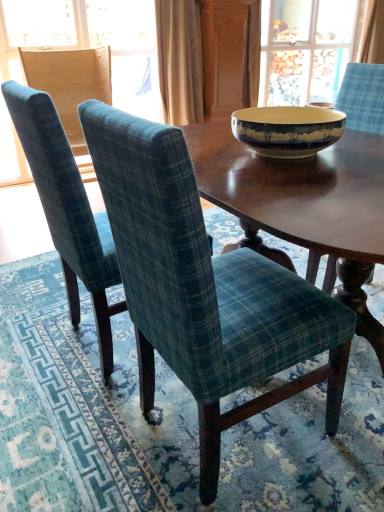
I want to click on free spot in front of matte ceramic bowl at center, so click(x=296, y=181).